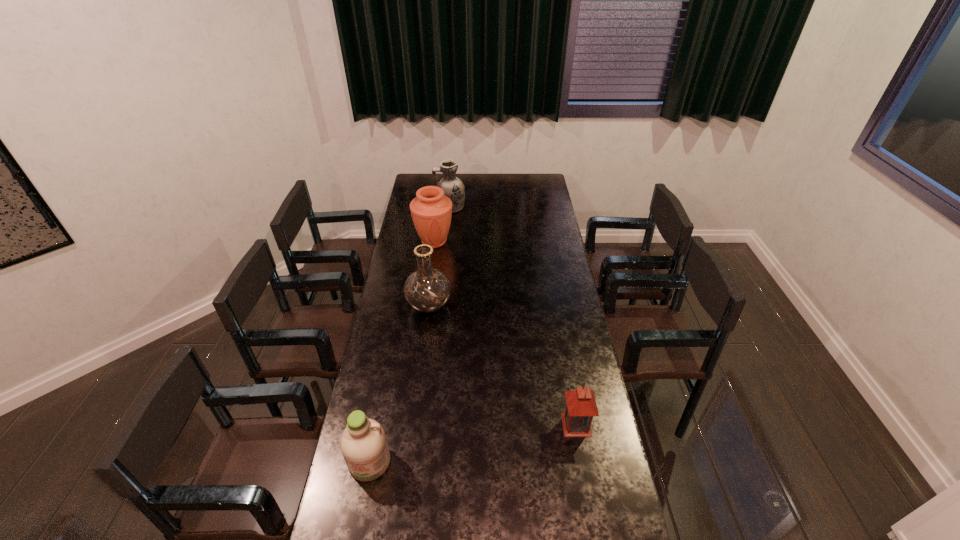
At what (x,y) coordinates should I click in order to perform the action: click on empty space between the farthest vase and the nearest vase. Please return your answer as a coordinate pair (x, y). Image resolution: width=960 pixels, height=540 pixels. Looking at the image, I should click on (440, 257).

This screenshot has width=960, height=540. Identify the location of empty location between the nearest vase and the farthest vase. (440, 257).

Locate an element on the screen. free space between the nearest vase and the cleansing agent is located at coordinates (399, 384).

Find the location of a particular element. Image resolution: width=960 pixels, height=540 pixels. free space between the cleansing agent and the nearest vase is located at coordinates (399, 384).

Where is `free space between the farthest vase and the lantern`? The image size is (960, 540). free space between the farthest vase and the lantern is located at coordinates (x=513, y=316).

Select which object appears as the closest to the lantern. Please provide its 2D coordinates. Your answer should be formatted as a tuple, i.e. [(x, y)], where the tuple contains the x and y coordinates of a point satisfying the conditions above.

[(363, 443)]

At what (x,y) coordinates should I click in order to perform the action: click on object that ranks as the fourth closest to the second nearest vase. Please return your answer as a coordinate pair (x, y). This screenshot has height=540, width=960. Looking at the image, I should click on (363, 443).

Locate an element on the screen. This screenshot has height=540, width=960. the closest vase relative to the cleansing agent is located at coordinates (427, 290).

What are the coordinates of `the third closest vase to the nearest object` in the screenshot? It's located at (453, 187).